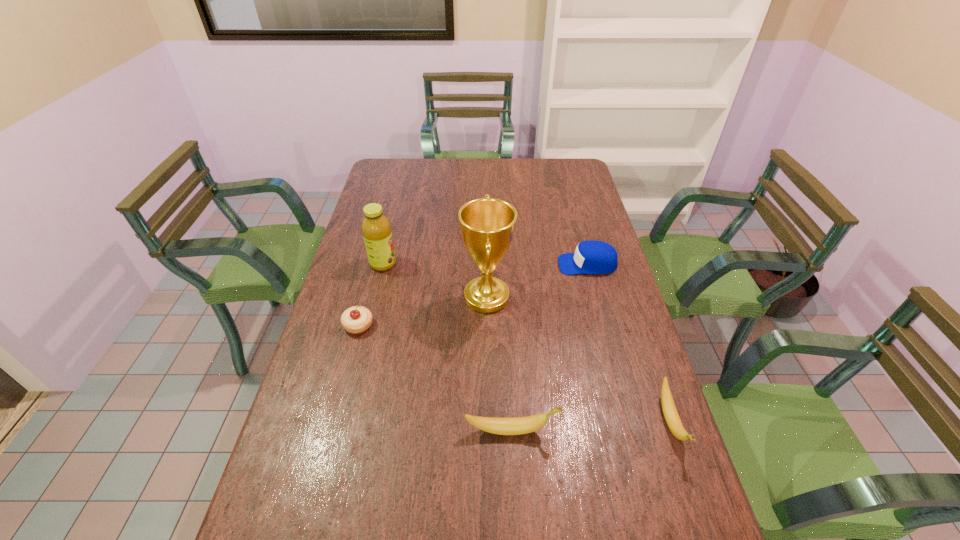
The height and width of the screenshot is (540, 960). I want to click on free region located on the front-facing side of the baseball cap, so click(489, 265).

Locate an element on the screen. The height and width of the screenshot is (540, 960). vacant position located 0.310m by the handles of the tallest object is located at coordinates (364, 297).

The image size is (960, 540). What are the coordinates of `vacant point located by the handles of the tallest object` in the screenshot? It's located at (430, 297).

Where is `vacant position located 0.130m by the handles of the tallest object`? Image resolution: width=960 pixels, height=540 pixels. vacant position located 0.130m by the handles of the tallest object is located at coordinates (420, 297).

Locate an element on the screen. vacant space located 0.360m on the right of the shortest object is located at coordinates (494, 325).

At what (x,y) coordinates should I click in order to perform the action: click on free space located on the front label of the fifth shortest object. Please return your answer as a coordinate pair (x, y). This screenshot has width=960, height=540. Looking at the image, I should click on (492, 264).

This screenshot has height=540, width=960. What are the coordinates of `pastry positioned at the left edge` in the screenshot? It's located at (357, 319).

Where is `fruit juice at the left edge`? fruit juice at the left edge is located at coordinates (376, 228).

You are a GUI agent. You are given a task and a screenshot of the screen. Output one action in this format:
    pyautogui.click(x=<x>, y=<y>)
    Task: Click on the banana present at the right edge
    This screenshot has height=540, width=960.
    Given the screenshot: What is the action you would take?
    pyautogui.click(x=672, y=418)

Locate an element on the screen. The image size is (960, 540). baseball cap situated at the right edge is located at coordinates (591, 257).